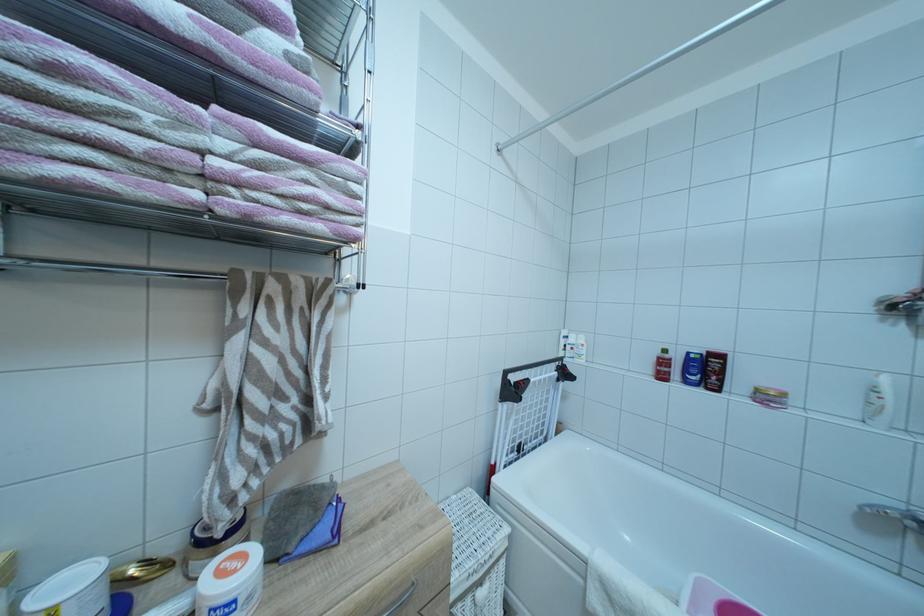
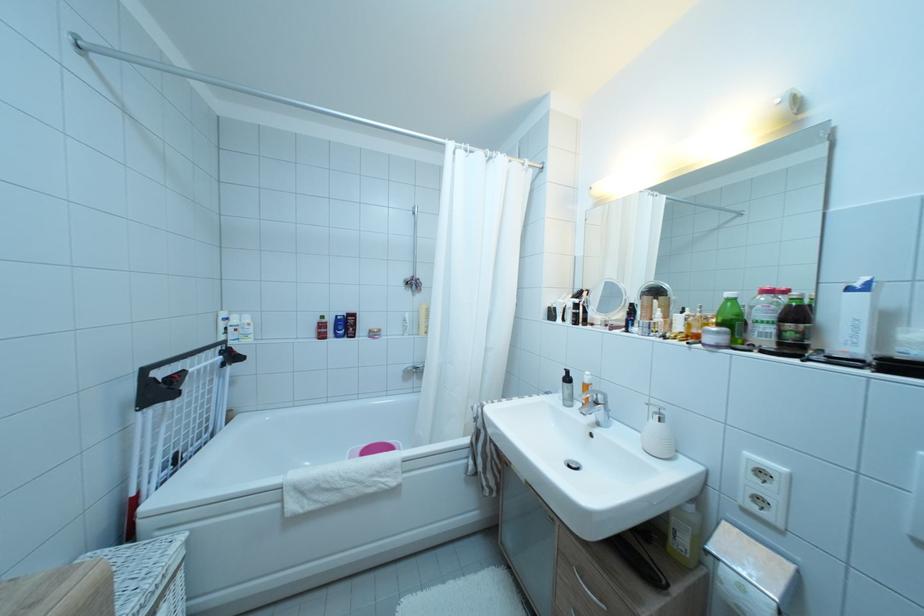
Where in the second image is the point corresponding to (x=691, y=377) from the first image?

(343, 334)